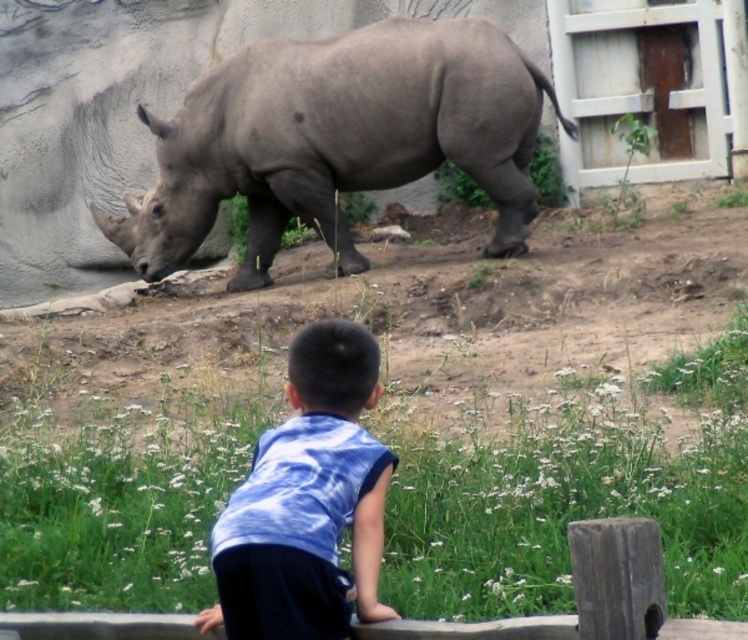
Between gray matte rhinoceros at upper center and blue tie-dye shirt at center, which one appears on the right side from the viewer's perspective?

blue tie-dye shirt at center

Who is more distant from viewer, (183, 237) or (295, 468)?

Point (183, 237)

Looking at this image, who is more distant from viewer, (328,120) or (358,340)?

Positioned behind is point (328,120).

The image size is (748, 640). Identify the location of gray matte rhinoceros at upper center. (337, 140).